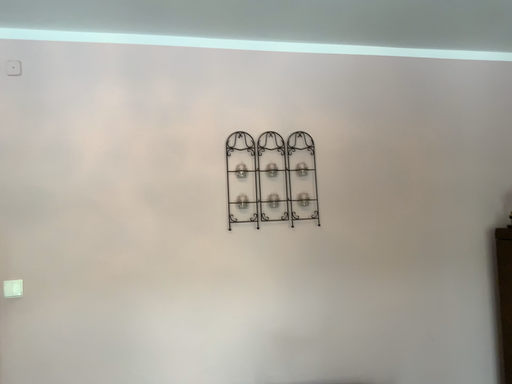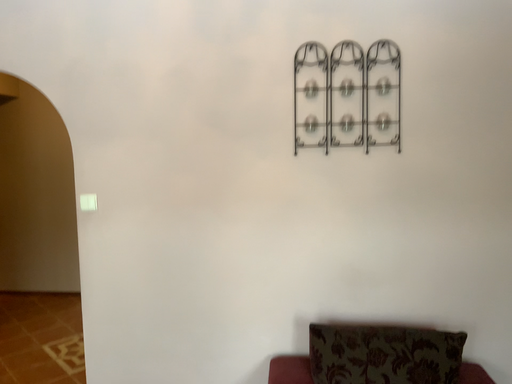
Question: Which way did the camera rotate in the video?

Choices:
 (A) rotated right
 (B) rotated left

Answer: (B)